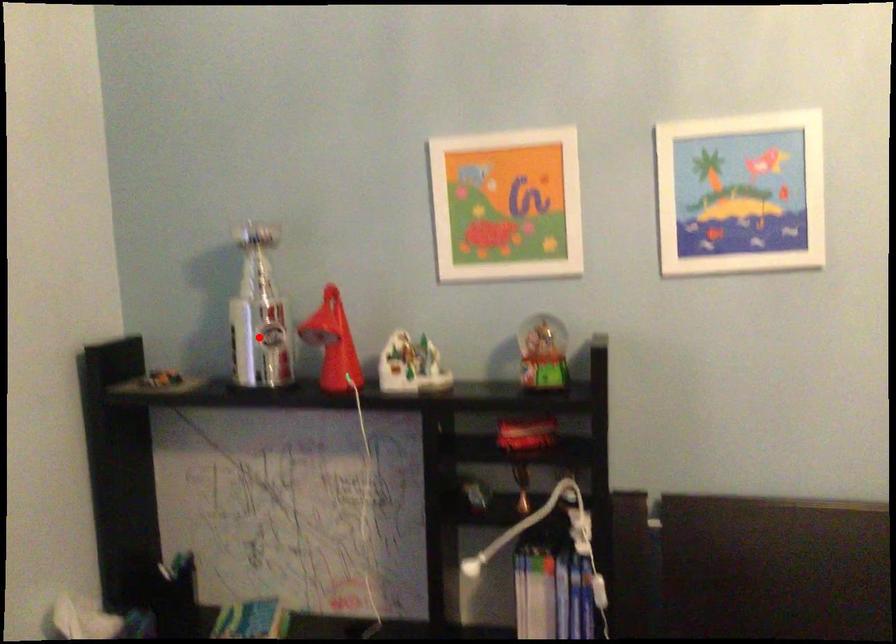
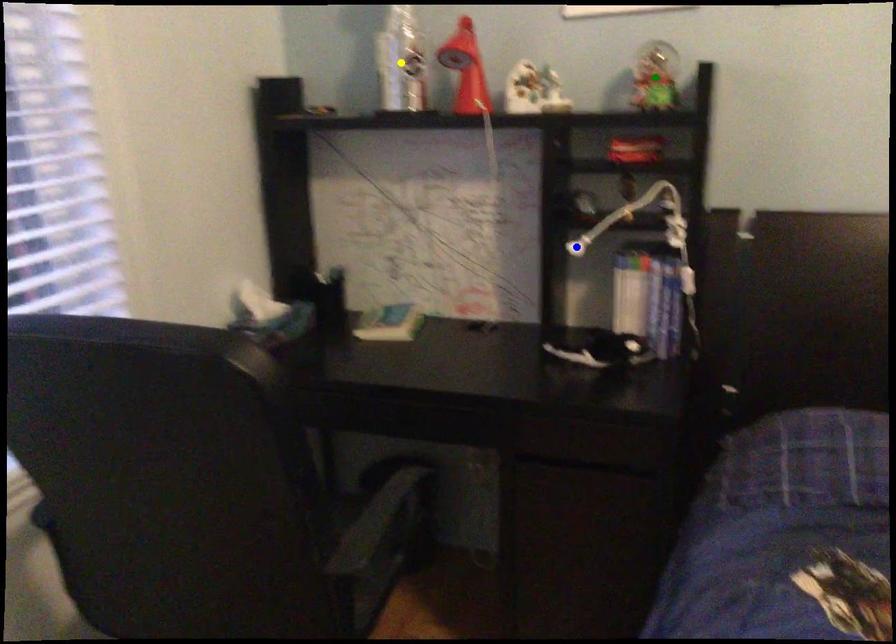
Question: I am providing you with two images of the same scene from different viewpoints. A red point is marked on the first image. You are given multiple points on the second image. Which mark in image 2 goes with the point in image 1?

Choices:
 (A) yellow point
 (B) blue point
 (C) green point

Answer: (A)